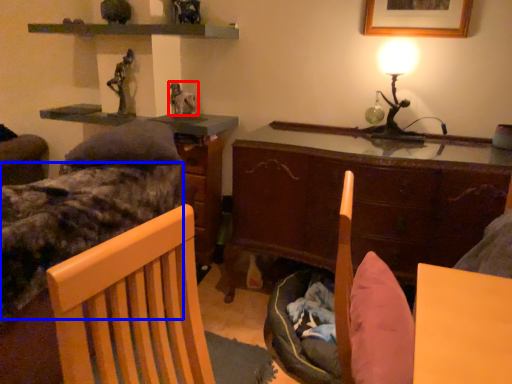
Question: Which of the following is the farthest to the observer, animal (highlighted by a red box) or bed frame (highlighted by a blue box)?

Choices:
 (A) animal
 (B) bed frame

Answer: (A)